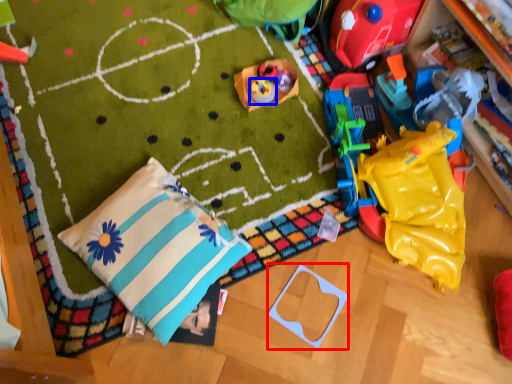
Question: Which object is closer to the camera taking this photo, toy (highlighted by a red box) or toy (highlighted by a blue box)?

Choices:
 (A) toy
 (B) toy

Answer: (A)